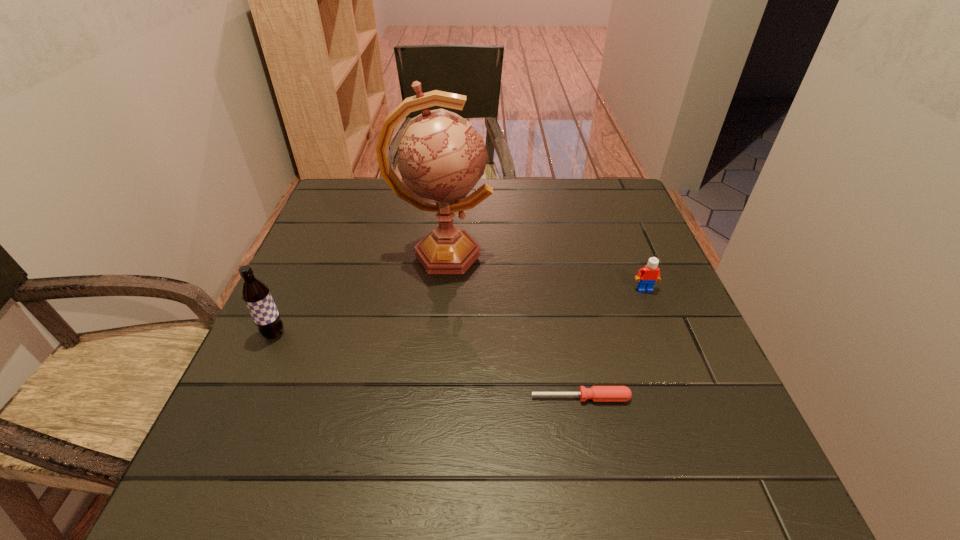
This screenshot has height=540, width=960. Identify the location of the farthest object. (441, 157).

Locate an element on the screen. the second object from left to right is located at coordinates (441, 157).

Locate an element on the screen. The height and width of the screenshot is (540, 960). root beer is located at coordinates (256, 295).

This screenshot has width=960, height=540. What are the coordinates of `the second nearest object` in the screenshot? It's located at (256, 295).

At what (x,y) coordinates should I click in order to perform the action: click on the rightmost object. Please return your answer as a coordinate pair (x, y). Looking at the image, I should click on (650, 273).

At what (x,y) coordinates should I click in order to perform the action: click on the third tallest object. Please return your answer as a coordinate pair (x, y). Looking at the image, I should click on (650, 273).

Find the location of a particular element. This screenshot has width=960, height=540. screwdriver is located at coordinates (596, 393).

The image size is (960, 540). I want to click on the second object from right to left, so click(x=596, y=393).

The image size is (960, 540). In order to click on free location located 0.060m on the front-facing side of the second object from left to right in this screenshot , I will do `click(516, 254)`.

The height and width of the screenshot is (540, 960). Find the location of `free space located 0.110m on the right of the third farthest object`. free space located 0.110m on the right of the third farthest object is located at coordinates (339, 334).